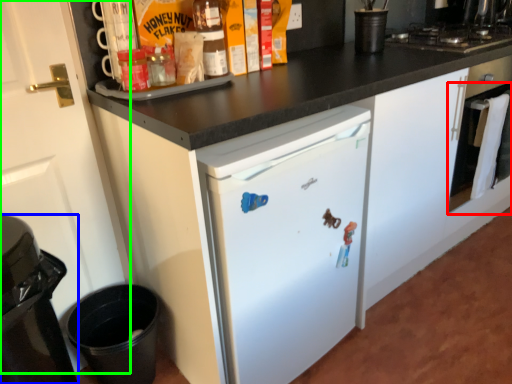
Question: Estimate the real-world distances between objects in this image. Which object is farther from oven (highlighted by a red box), home appliance (highlighted by a blue box) or door (highlighted by a green box)?

Choices:
 (A) home appliance
 (B) door

Answer: (A)